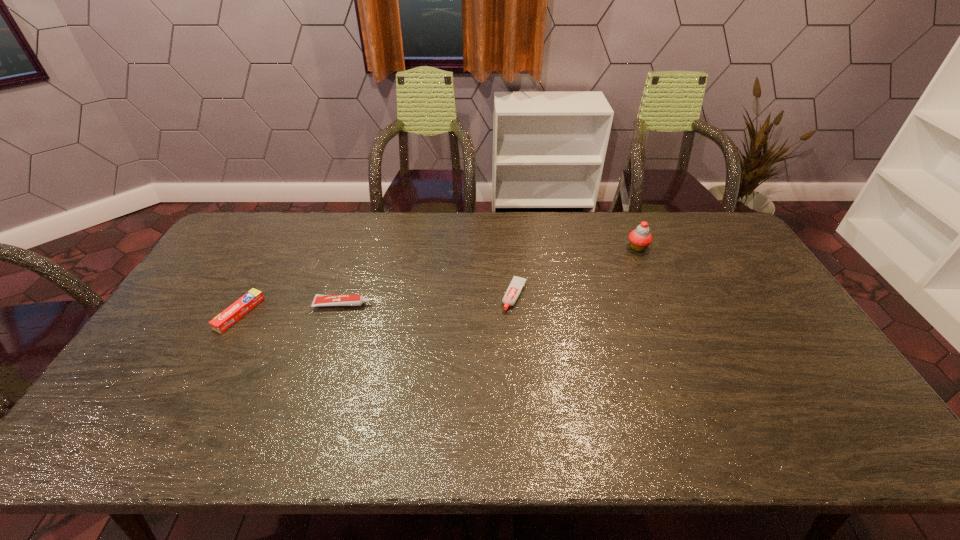
What are the coordinates of `object at the left edge` in the screenshot? It's located at (239, 308).

Identify the location of vacant region at the far edge of the desktop. This screenshot has height=540, width=960. (614, 246).

The height and width of the screenshot is (540, 960). In order to click on free location at the left edge of the desktop in this screenshot , I will do `click(195, 333)`.

In the image, there is a desktop. What are the coordinates of `blank space at the right edge` in the screenshot? It's located at (745, 331).

In the image, there is a desktop. Identify the location of vacant space at the far left corner. (256, 232).

Locate an element on the screen. This screenshot has width=960, height=540. vacant region at the far right corner of the desktop is located at coordinates (700, 219).

At what (x,y) coordinates should I click in order to perform the action: click on free space between the rightmost object and the rightmost toothpaste. Please return your answer as a coordinate pair (x, y). Image resolution: width=960 pixels, height=540 pixels. Looking at the image, I should click on (576, 272).

Where is `free spot between the second toothpaste from left to right and the leftmost object`? free spot between the second toothpaste from left to right and the leftmost object is located at coordinates (291, 309).

The height and width of the screenshot is (540, 960). In order to click on vacant space in between the leftmost object and the second object from right to left in this screenshot , I will do `click(377, 305)`.

I want to click on free area in between the second object from left to right and the second object from right to left, so click(429, 300).